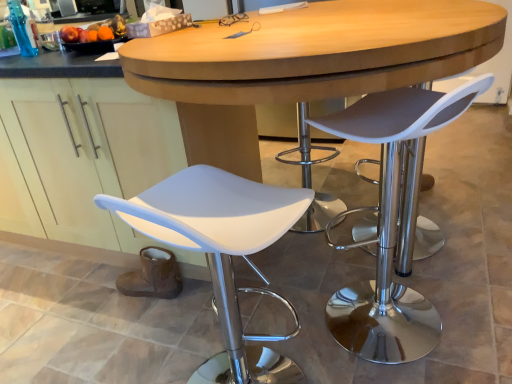
This screenshot has width=512, height=384. In order to click on free space behind white matte chair at lower left, which is counted as the first chair, starting from the left in this screenshot , I will do `click(243, 320)`.